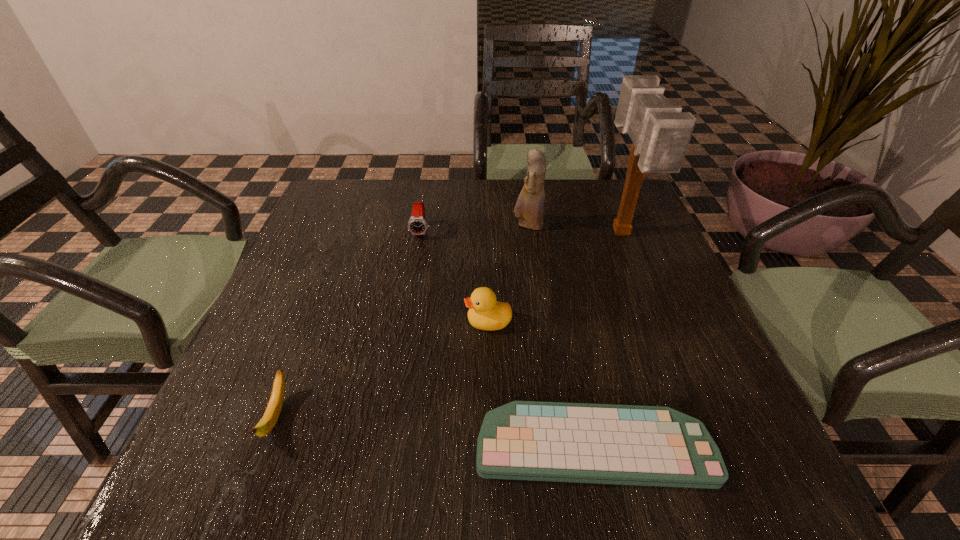
Locate an element on the screen. This screenshot has height=540, width=960. free point that satisfies the following two spatial constraints: 1. on the face of the fifth object from right to left; 2. on the left side of the mallet is located at coordinates (421, 234).

You are a GUI agent. You are given a task and a screenshot of the screen. Output one action in this format:
    pyautogui.click(x=<x>, y=<y>)
    Task: Click on the free location that satisfies the following two spatial constraints: 1. at the beak of the fourth farthest object; 2. at the stem of the second shortest object
    
    Given the screenshot: What is the action you would take?
    pyautogui.click(x=490, y=417)

Where is `vacant space that satisfies the following two spatial constraints: 1. on the back side of the tallest object; 2. on the front-facing side of the second tallest object`? The width and height of the screenshot is (960, 540). vacant space that satisfies the following two spatial constraints: 1. on the back side of the tallest object; 2. on the front-facing side of the second tallest object is located at coordinates (618, 226).